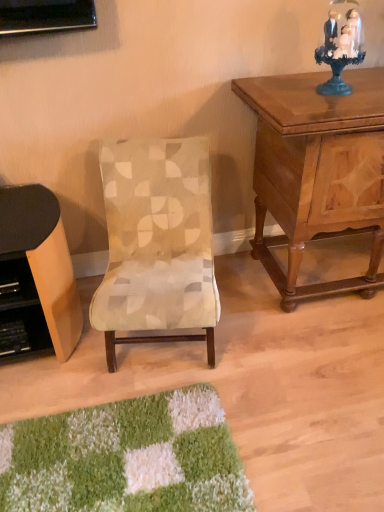
Where is `blank area to the left of blue glass figurine at upper right`? This screenshot has height=512, width=384. blank area to the left of blue glass figurine at upper right is located at coordinates (283, 96).